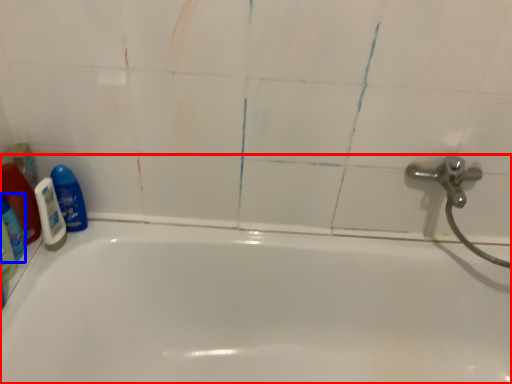
Question: Which object is closer to the camera taking this photo, bathtub (highlighted by a red box) or cleaning product (highlighted by a blue box)?

Choices:
 (A) bathtub
 (B) cleaning product

Answer: (A)